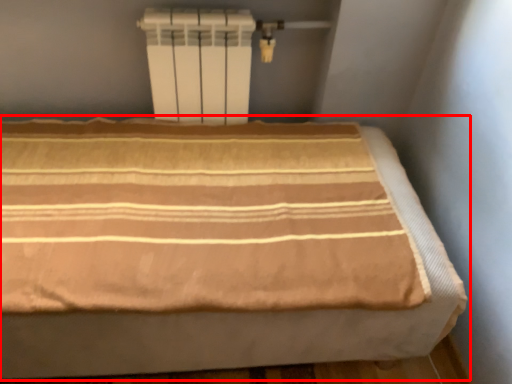
Question: From the image's perspective, where is bed (annotated by the red box) located relative to water heater?

Choices:
 (A) above
 (B) below

Answer: (B)